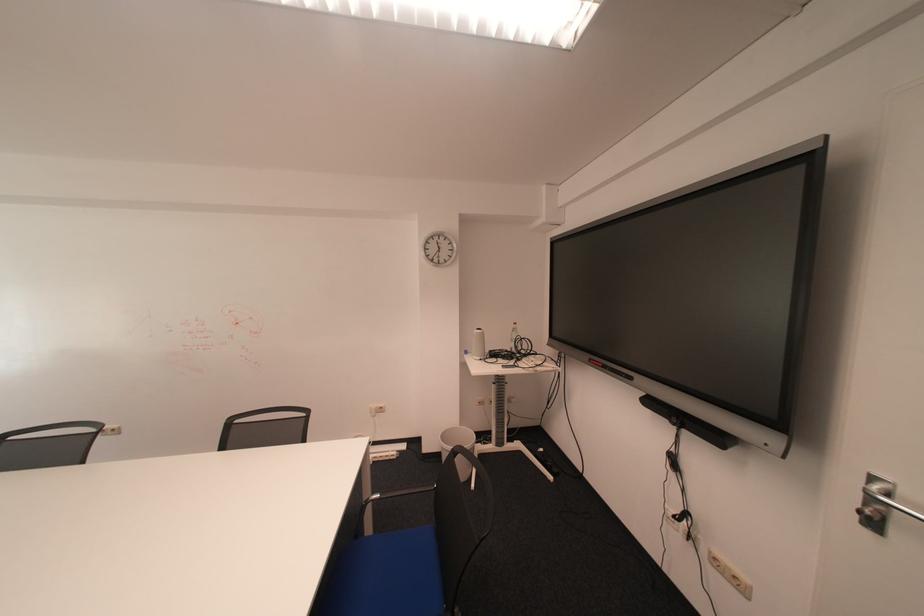
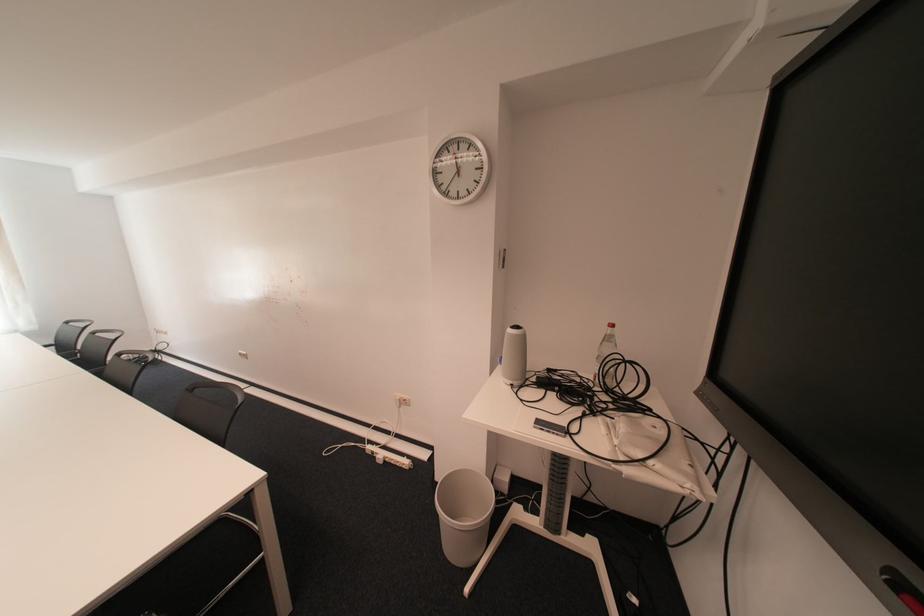
Find the pixel in the second image that matches pixel 490 359 in the first image.

(520, 383)